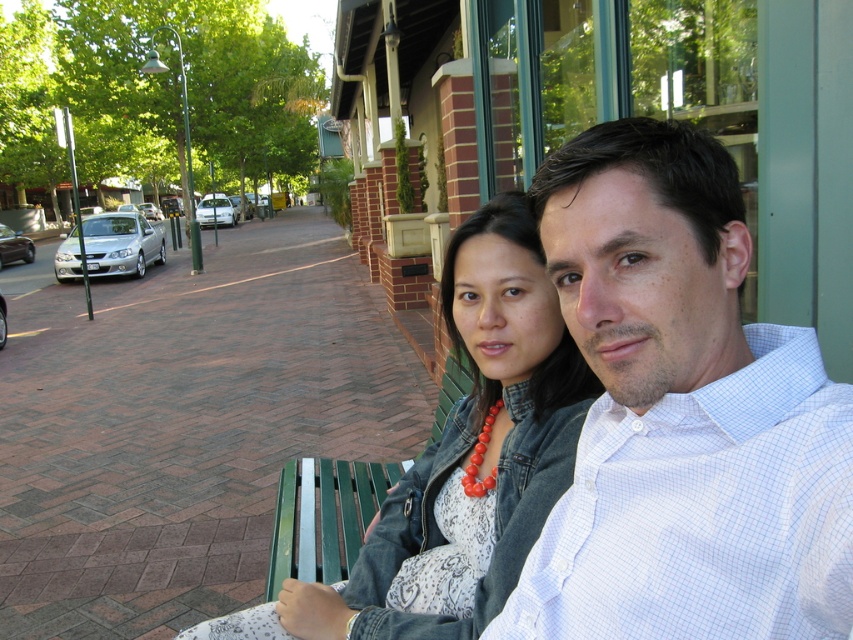
Question: Does white checkered shirt at center appear over denim jacket at center?

Choices:
 (A) yes
 (B) no

Answer: (A)

Question: Does white checkered shirt at center appear under denim jacket at center?

Choices:
 (A) yes
 (B) no

Answer: (B)

Question: Among these points, which one is nearest to the camera?

Choices:
 (A) (602, 586)
 (B) (392, 525)

Answer: (A)

Question: Which object appears closest to the camera in this image?

Choices:
 (A) white checkered shirt at center
 (B) denim jacket at center

Answer: (A)

Question: Does white checkered shirt at center appear under denim jacket at center?

Choices:
 (A) no
 (B) yes

Answer: (A)

Question: Among these objects, which one is nearest to the camera?

Choices:
 (A) denim jacket at center
 (B) white checkered shirt at center

Answer: (B)